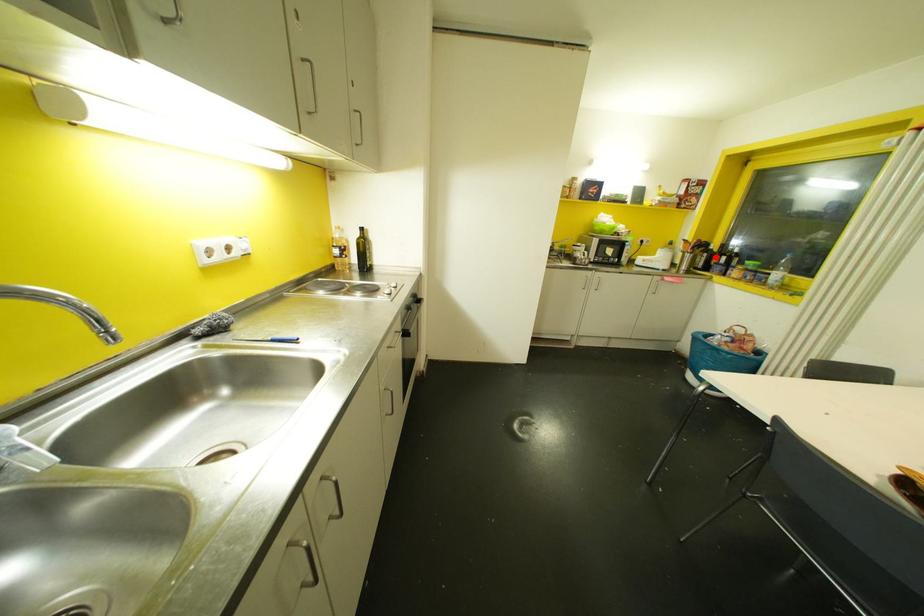
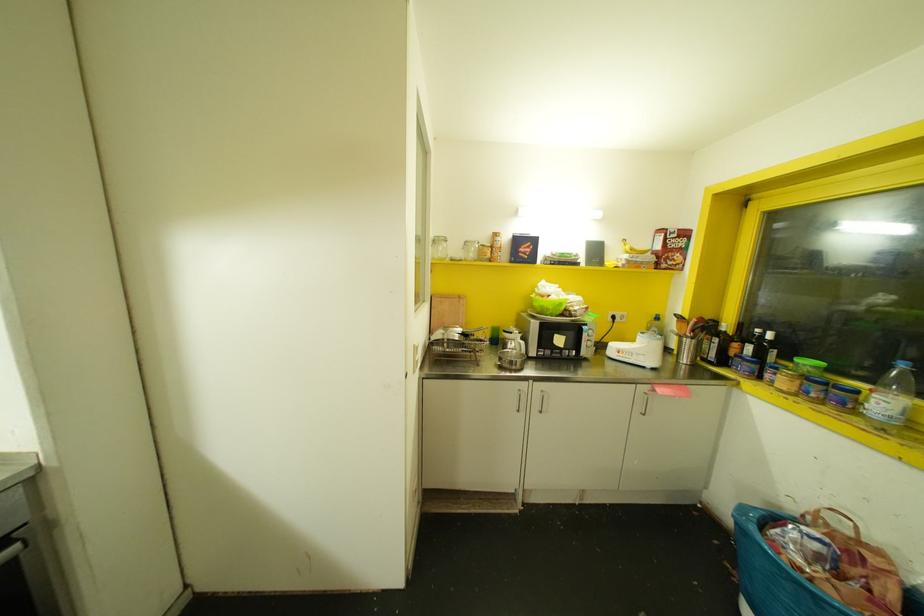
Find the pixel in the second image that matches the highlighted location in the first image.

(735, 345)